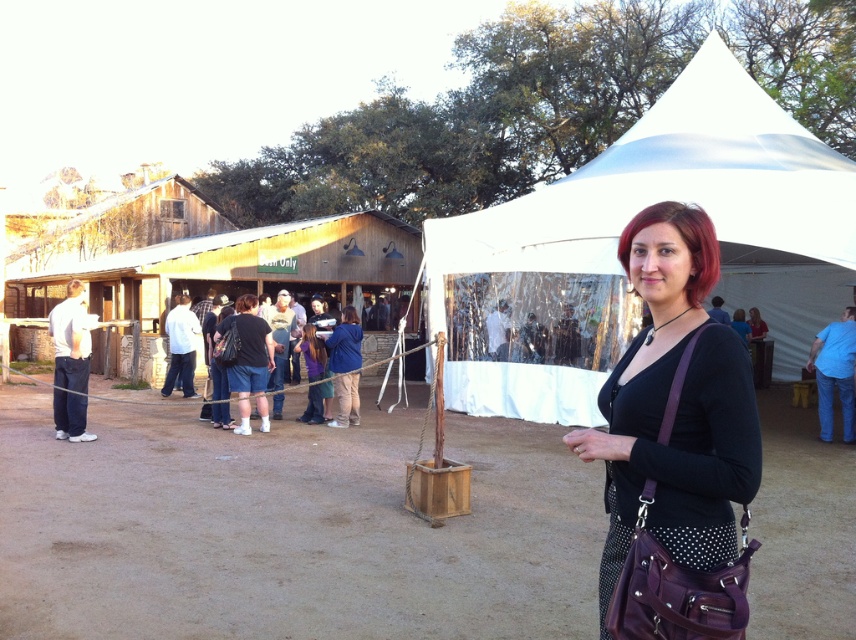
You are at an outdoor event and see a black dotted fabric at center and a white shirt at left. Which object is located to the right of the other?

The black dotted fabric at center is positioned on the right side of white shirt at left.